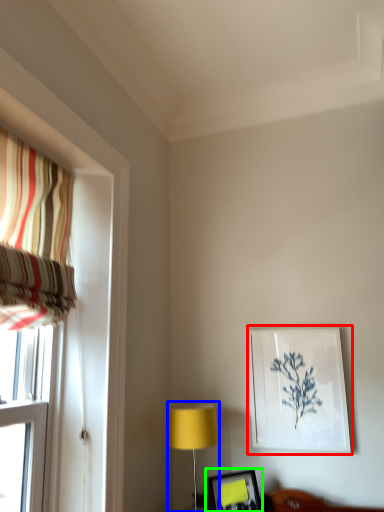
Question: Which is nearer to the picture frame (highlighted by a red box)? table lamp (highlighted by a blue box) or picture frame (highlighted by a green box).

Choices:
 (A) table lamp
 (B) picture frame

Answer: (B)